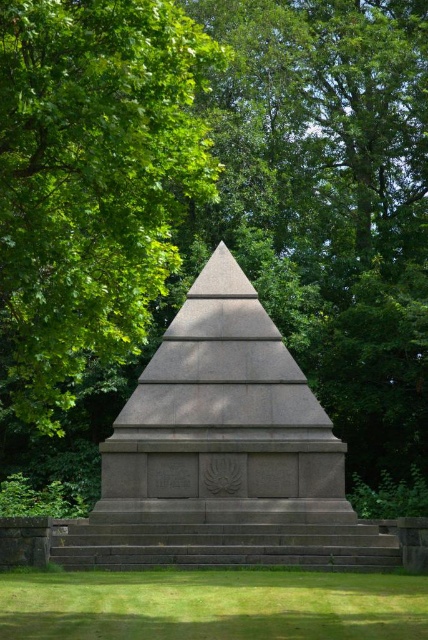
Can you confirm if gray stone pyramid at center is wider than green grass at lower center?

No, gray stone pyramid at center is not wider than green grass at lower center.

Is gray stone pyramid at center thinner than green grass at lower center?

Yes, gray stone pyramid at center is thinner than green grass at lower center.

Identify the location of gray stone pyramid at center. The image size is (428, 640). (222, 452).

Looking at this image, which is more to the left, green leafy tree at center or green grass at lower center?

green leafy tree at center is more to the left.

Is green leafy tree at center taller than green grass at lower center?

Yes.

Who is more distant from viewer, (12, 125) or (410, 602)?

Point (410, 602)

Find the location of a particular element. This screenshot has height=640, width=428. green leafy tree at center is located at coordinates (92, 182).

Is green leafy tree at center wider than gray stone pyramid at center?

Indeed, green leafy tree at center has a greater width compared to gray stone pyramid at center.

Is green leafy tree at center below gray stone pyramid at center?

Result: Actually, green leafy tree at center is above gray stone pyramid at center.

Identify the location of green leafy tree at center. The image size is (428, 640). (92, 182).